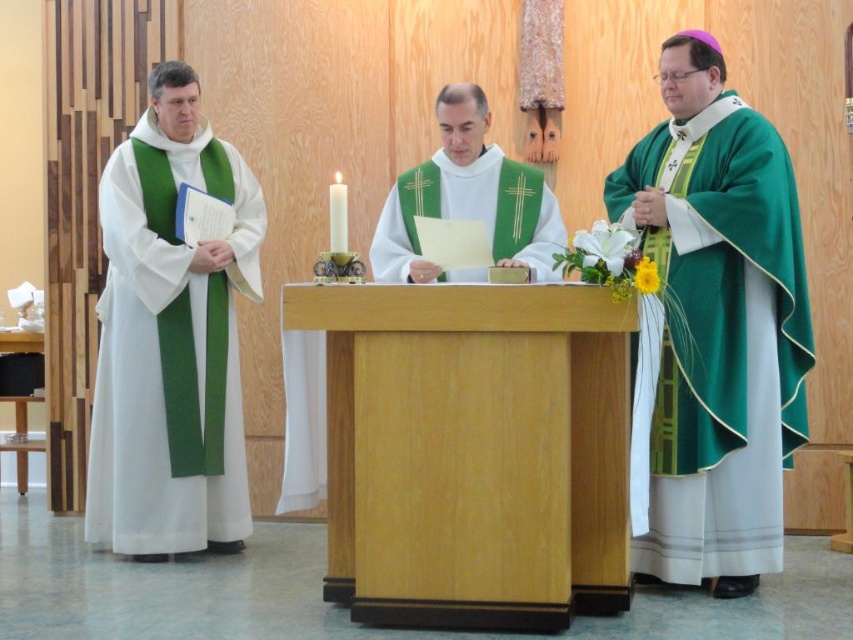
Question: Is white matte vestment at left smaller than green satin vestment at center?

Choices:
 (A) yes
 (B) no

Answer: (B)

Question: Which of the following is the closest to the observer?

Choices:
 (A) (103, 241)
 (B) (561, 241)
 (C) (759, 324)
 (D) (563, 477)

Answer: (D)

Question: Is light wood pulpit at center positioned behind green satin robe at right?

Choices:
 (A) no
 (B) yes

Answer: (A)

Question: Which point is closer to the camera taking this photo?

Choices:
 (A) (694, 496)
 (B) (395, 273)
 (C) (503, 419)
 (D) (148, 168)

Answer: (C)

Question: Which point is farther to the camera?

Choices:
 (A) (495, 227)
 (B) (265, 220)
 (C) (724, 234)

Answer: (B)

Question: Is green satin robe at right to the right of white matte vestment at left from the viewer's perspective?

Choices:
 (A) yes
 (B) no

Answer: (A)